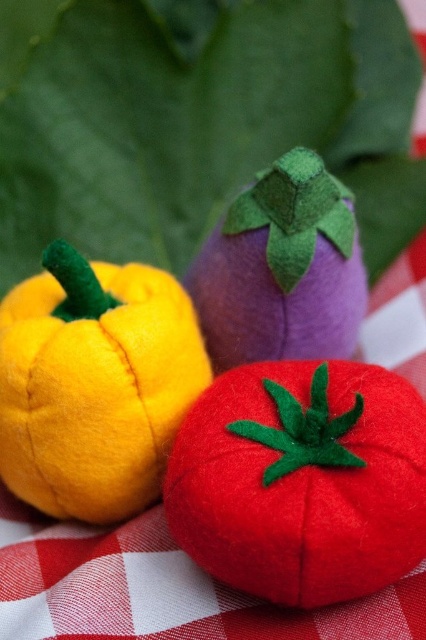
Between point (394, 508) and point (97, 385), which one is positioned behind?

The point (97, 385) is more distant.

Where is `matte felt tomato at center`? This screenshot has height=640, width=426. matte felt tomato at center is located at coordinates (302, 481).

Locate an element on the screen. matte felt tomato at center is located at coordinates (302, 481).

Identify the location of matte felt tomato at center. (302, 481).

Is matte felt tomato at center closer to the viewer compared to purple felt eggplant at center?

Yes, it is in front of purple felt eggplant at center.

This screenshot has height=640, width=426. In order to click on matte felt tomato at center in this screenshot , I will do `click(302, 481)`.

Describe the element at coordinates (94, 384) in the screenshot. The image size is (426, 640). I see `matte yellow felt pepper at left` at that location.

Can you confirm if matte yellow felt pepper at left is taller than purple felt eggplant at center?

Correct, matte yellow felt pepper at left is much taller as purple felt eggplant at center.

Image resolution: width=426 pixels, height=640 pixels. In order to click on matte yellow felt pepper at left in this screenshot , I will do `click(94, 384)`.

Find the location of `matte yellow felt pepper at left`. matte yellow felt pepper at left is located at coordinates 94,384.